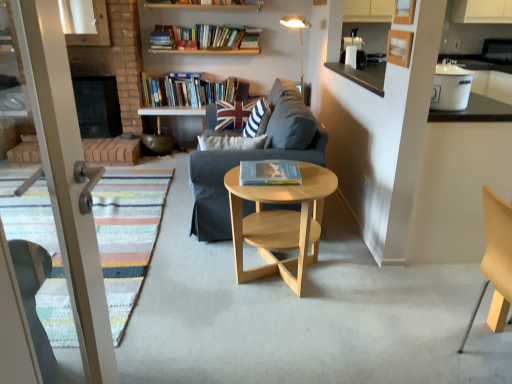
The image size is (512, 384). Find the location of `hardcover books at upper center, the 2th book when ordered from bottom to top`. hardcover books at upper center, the 2th book when ordered from bottom to top is located at coordinates (190, 91).

Identify the location of natural wood coffee table at center. This screenshot has width=512, height=384. (280, 222).

Is white striped fabric pillow at center, which is the 2th pillow in back-to-front order, turned away from white glossy container at upper right?

No, white glossy container at upper right is not at the back of white striped fabric pillow at center, which is the 2th pillow in back-to-front order.

Considering the sizes of white striped fabric pillow at center, which is the 2th pillow in back-to-front order, and white glossy container at upper right in the image, is white striped fabric pillow at center, which is the 2th pillow in back-to-front order, wider or thinner than white glossy container at upper right?

Considering their sizes, white striped fabric pillow at center, which is the 2th pillow in back-to-front order, looks slimmer than white glossy container at upper right.

Is white striped fabric pillow at center, marked as the first pillow in a front-to-back arrangement, to the right of white glossy container at upper right from the viewer's perspective?

No.

Is white striped fabric pillow at center, which is the 2th pillow in back-to-front order, surrounded by metallic gold floor lamp at upper center?

No.

Which pillow is the 1st one when counting from the left side of the metallic gold floor lamp at upper center? Please provide its 2D coordinates.

[(257, 119)]

Who is taller, metallic gold floor lamp at upper center or white striped fabric pillow at center, marked as the first pillow in a front-to-back arrangement?

metallic gold floor lamp at upper center is taller.

Is metallic gold floor lamp at upper center oriented towards hardcover book at center, the first book positioned from the front?

No, metallic gold floor lamp at upper center is not aimed at hardcover book at center, the first book positioned from the front.

Considering the relative sizes of metallic gold floor lamp at upper center and hardcover book at center, the second book from the back, in the image provided, is metallic gold floor lamp at upper center bigger than hardcover book at center, the second book from the back,?

Correct, metallic gold floor lamp at upper center is larger in size than hardcover book at center, the second book from the back.

Can you tell me how much metallic gold floor lamp at upper center and hardcover book at center, arranged as the 1th book when ordered from the bottom, differ in facing direction?

The facing directions of metallic gold floor lamp at upper center and hardcover book at center, arranged as the 1th book when ordered from the bottom, are 48.8 degrees apart.

Consider the image. Which is farther from the camera, (291, 22) or (270, 178)?

Point (291, 22)

Is white striped fabric pillow at center, which is the 2th pillow in back-to-front order, in front of or behind hardcover books at upper center, which ranks as the 2th book in right-to-left order, in the image?

white striped fabric pillow at center, which is the 2th pillow in back-to-front order, is positioned closer to the viewer than hardcover books at upper center, which ranks as the 2th book in right-to-left order.

Considering the relative sizes of white striped fabric pillow at center, marked as the first pillow in a front-to-back arrangement, and hardcover books at upper center, the first book positioned from the top, in the image provided, is white striped fabric pillow at center, marked as the first pillow in a front-to-back arrangement, thinner than hardcover books at upper center, the first book positioned from the top,?

Indeed, white striped fabric pillow at center, marked as the first pillow in a front-to-back arrangement, has a lesser width compared to hardcover books at upper center, the first book positioned from the top.

How many degrees apart are the facing directions of white striped fabric pillow at center, which is the 2th pillow in back-to-front order, and hardcover books at upper center, which is counted as the first book, starting from the left?

The angle between the facing direction of white striped fabric pillow at center, which is the 2th pillow in back-to-front order, and the facing direction of hardcover books at upper center, which is counted as the first book, starting from the left, is 90.3 degrees.

Can you confirm if white striped fabric pillow at center, which is the 2th pillow in back-to-front order, is taller than hardcover books at upper center, the 2th book when ordered from bottom to top?

Correct, white striped fabric pillow at center, which is the 2th pillow in back-to-front order, is much taller as hardcover books at upper center, the 2th book when ordered from bottom to top.

Is dark gray fabric couch at center bigger than white glossy container at upper right?

Correct, dark gray fabric couch at center is larger in size than white glossy container at upper right.

Does dark gray fabric couch at center turn towards white glossy container at upper right?

No, dark gray fabric couch at center does not turn towards white glossy container at upper right.

Considering the relative positions of dark gray fabric couch at center and white glossy container at upper right in the image provided, is dark gray fabric couch at center to the left of white glossy container at upper right from the viewer's perspective?

Yes, dark gray fabric couch at center is to the left of white glossy container at upper right.

Is dark gray fabric couch at center positioned behind white glossy container at upper right?

Yes, dark gray fabric couch at center is further from the camera.

Is hardcover books at upper center, placed as the second book when sorted from front to back, in front of metallic gold floor lamp at upper center?

No, hardcover books at upper center, placed as the second book when sorted from front to back, is further to the viewer.

Is hardcover books at upper center, which is counted as the first book, starting from the left, oriented towards metallic gold floor lamp at upper center?

No, hardcover books at upper center, which is counted as the first book, starting from the left, is not oriented towards metallic gold floor lamp at upper center.

Are hardcover books at upper center, which ranks as the 2th book in right-to-left order, and metallic gold floor lamp at upper center far apart?

Indeed, hardcover books at upper center, which ranks as the 2th book in right-to-left order, is not near metallic gold floor lamp at upper center.

Is white glossy container at upper right not inside hardcover book at center, which is counted as the first book, starting from the right?

Yes, white glossy container at upper right is not within hardcover book at center, which is counted as the first book, starting from the right.

Is white glossy container at upper right facing away from hardcover book at center, the second book from the back?

Absolutely, white glossy container at upper right is directed away from hardcover book at center, the second book from the back.

Is white glossy container at upper right with hardcover book at center, the first book positioned from the front?

They are not placed beside each other.

From a real-world perspective, is white glossy container at upper right on hardcover book at center, the second book from the back?

Correct, in the physical world, white glossy container at upper right is higher than hardcover book at center, the second book from the back.

The image size is (512, 384). I want to click on appliance to the right of white striped fabric pillow at center, which is the 2th pillow in back-to-front order, so click(x=451, y=87).

Image resolution: width=512 pixels, height=384 pixels. Find the location of `pillow that is the 1st one below the metallic gold floor lamp at upper center (from a real-world perspective)`. pillow that is the 1st one below the metallic gold floor lamp at upper center (from a real-world perspective) is located at coordinates (257, 119).

Looking at the image, which one is located closer to hardcover books at upper center, arranged as the first book when viewed from the back, hardcover book at center, arranged as the 1th book when ordered from the bottom, or union jack fabric pillow at center, the 1th pillow in the back-to-front sequence?

union jack fabric pillow at center, the 1th pillow in the back-to-front sequence, is positioned closer to the anchor hardcover books at upper center, arranged as the first book when viewed from the back.

Considering their positions, is dark gray fabric couch at center positioned further to white glossy container at upper right than hardcover books at upper center, the first book positioned from the top?

Among the two, hardcover books at upper center, the first book positioned from the top, is located further to white glossy container at upper right.

Which object lies nearer to the anchor point hardcover book at center, the second book from the back, white glossy container at upper right or union jack fabric pillow at center, the 1th pillow in the back-to-front sequence?

Among the two, white glossy container at upper right is located nearer to hardcover book at center, the second book from the back.

Based on their spatial positions, is white striped fabric pillow at center, which is the 2th pillow in back-to-front order, or white glossy container at upper right further from union jack fabric pillow at center, the 2th pillow in the front-to-back sequence?

white glossy container at upper right is further to union jack fabric pillow at center, the 2th pillow in the front-to-back sequence.

Considering their positions, is white striped fabric pillow at center, which is the 2th pillow in back-to-front order, positioned closer to hardcover book at center, the second book from the back, than union jack fabric pillow at center, the 1th pillow in the back-to-front sequence?

white striped fabric pillow at center, which is the 2th pillow in back-to-front order, lies closer to hardcover book at center, the second book from the back, than the other object.

Considering their positions, is white glossy container at upper right positioned further to union jack fabric pillow at center, the 1th pillow in the back-to-front sequence, than metallic gold floor lamp at upper center?

Among the two, white glossy container at upper right is located further to union jack fabric pillow at center, the 1th pillow in the back-to-front sequence.

Looking at the image, which one is located further to hardcover book at center, which appears as the 2th book when viewed from the top, dark gray fabric couch at center or metallic gold floor lamp at upper center?

metallic gold floor lamp at upper center is positioned further to the anchor hardcover book at center, which appears as the 2th book when viewed from the top.

In the scene shown: From the image, which object appears to be farther from hardcover books at upper center, the 2th book when ordered from bottom to top, natural wood coffee table at center or white striped fabric pillow at center, which is the 2th pillow in back-to-front order?

Based on the image, natural wood coffee table at center appears to be further to hardcover books at upper center, the 2th book when ordered from bottom to top.

Where is `studio couch positioned between white glossy container at upper right and union jack fabric pillow at center, the 2th pillow in the front-to-back sequence, from near to far`? Image resolution: width=512 pixels, height=384 pixels. studio couch positioned between white glossy container at upper right and union jack fabric pillow at center, the 2th pillow in the front-to-back sequence, from near to far is located at coordinates (253, 159).

Locate an element on the screen. appliance between natural wood coffee table at center and hardcover books at upper center, the first book positioned from the top, from front to back is located at coordinates (451, 87).

Image resolution: width=512 pixels, height=384 pixels. What are the coordinates of `book between natural wood coffee table at center and union jack fabric pillow at center, the 1th pillow in the back-to-front sequence, from front to back` in the screenshot? It's located at (270, 173).

Locate an element on the screen. This screenshot has height=384, width=512. lamp located between natural wood coffee table at center and hardcover books at upper center, arranged as the first book when viewed from the back, in the depth direction is located at coordinates (300, 39).